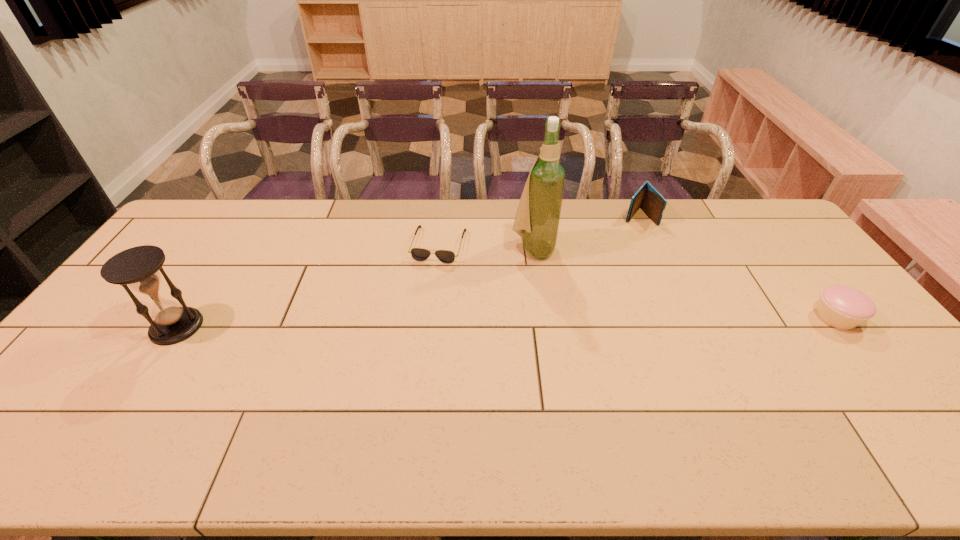
In order to click on empty location between the hourglass and the tallest object in this screenshot , I will do `click(354, 288)`.

I want to click on free point between the third object from right to left and the hourglass, so click(354, 288).

This screenshot has width=960, height=540. Identify the location of empty space between the leftmost object and the cupcake. (506, 322).

Find the location of a particular element. free point between the fourth tallest object and the leftmost object is located at coordinates (506, 322).

At what (x,y) coordinates should I click in order to perform the action: click on vacant area that lies between the third tallest object and the third object from right to left. Please return your answer as a coordinate pair (x, y). Looking at the image, I should click on (586, 232).

Find the location of `vacant space in between the shortest object and the cupcake`. vacant space in between the shortest object and the cupcake is located at coordinates (637, 281).

At what (x,y) coordinates should I click in order to perform the action: click on vacant space in between the third object from left to right and the fourth object from right to left. Please return your answer as a coordinate pair (x, y). Looking at the image, I should click on (486, 247).

Locate which object is the fourth closest to the wallet. Please provide its 2D coordinates. Your answer should be formatted as a tuple, i.e. [(x, y)], where the tuple contains the x and y coordinates of a point satisfying the conditions above.

[(138, 268)]

Locate which object is the second closest to the fourth object from left to right. Please provide its 2D coordinates. Your answer should be formatted as a tuple, i.e. [(x, y)], where the tuple contains the x and y coordinates of a point satisfying the conditions above.

[(842, 307)]

The width and height of the screenshot is (960, 540). Find the location of `free space that satisfies the following two spatial constraints: 1. on the back side of the second object from left to right; 2. on the right side of the second tallest object`. free space that satisfies the following two spatial constraints: 1. on the back side of the second object from left to right; 2. on the right side of the second tallest object is located at coordinates (230, 245).